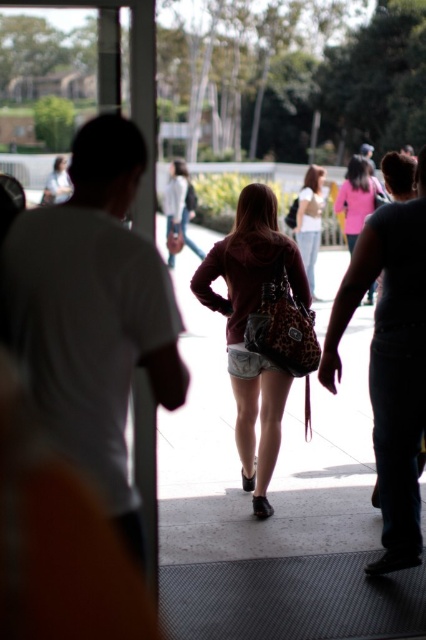
Who is more distant from viewer, (362, 186) or (310, 280)?

The point (362, 186) is behind.

Is point (348, 186) farther from camera compared to point (307, 188)?

Yes, point (348, 186) is behind point (307, 188).

Between point (362, 173) and point (311, 253), which one is positioned in front?

Point (311, 253)

Find the location of `pink fabric jacket at upper center`. pink fabric jacket at upper center is located at coordinates (356, 196).

Based on the photo, does leopard print bag at center have a greater height compared to white matte shirt at center?

Yes.

Can you confirm if leopard print bag at center is positioned below white matte shirt at center?

Indeed, leopard print bag at center is positioned under white matte shirt at center.

Image resolution: width=426 pixels, height=640 pixels. What are the coordinates of `leopard print bag at center` in the screenshot? It's located at (261, 330).

Locate an element on the screen. Image resolution: width=426 pixels, height=640 pixels. leopard print bag at center is located at coordinates (261, 330).

Is the position of leopard print bag at center less distant than that of pink fabric jacket at upper center?

That is True.

The image size is (426, 640). In order to click on leopard print bag at center in this screenshot , I will do `click(261, 330)`.